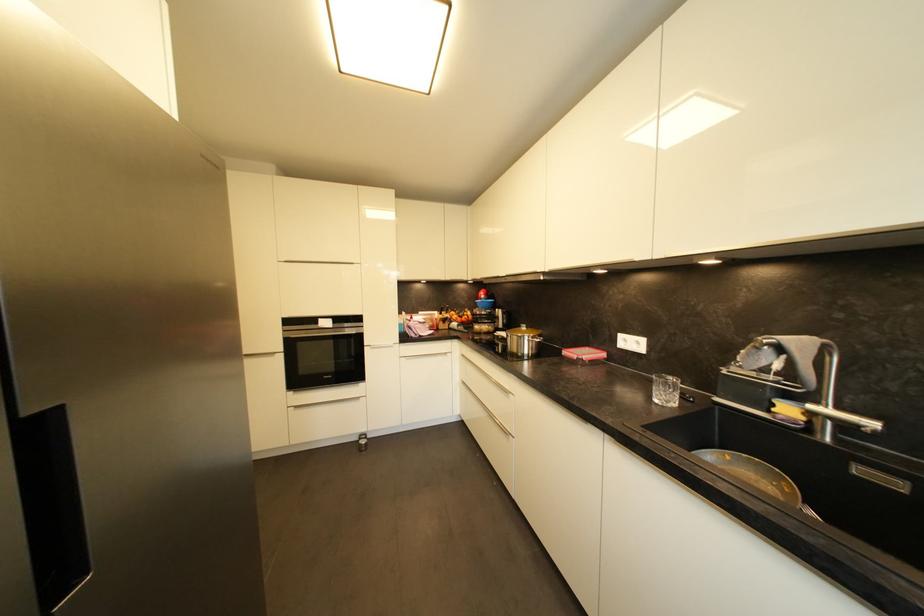
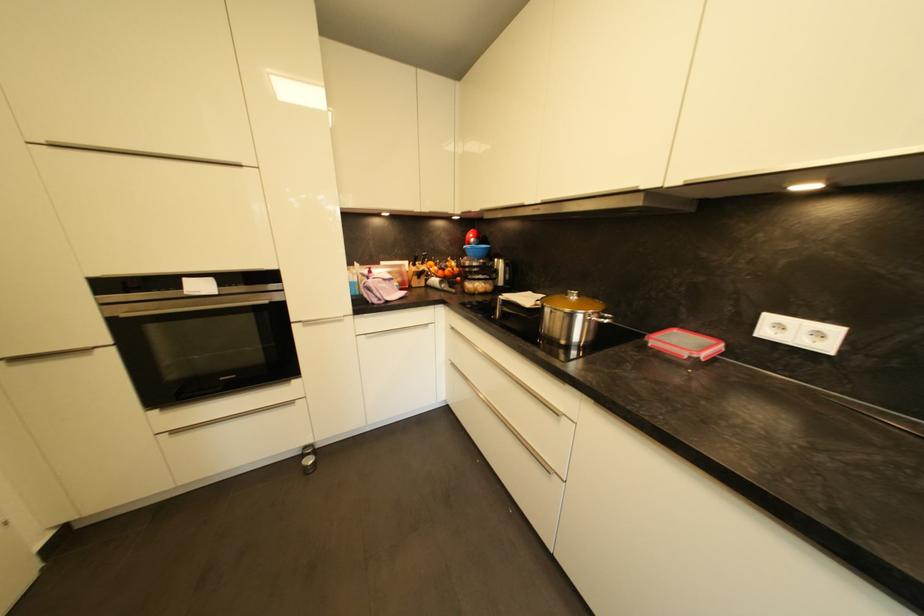
Locate, in the second image, the point that corresponds to point 369,444 in the first image.

(313, 463)